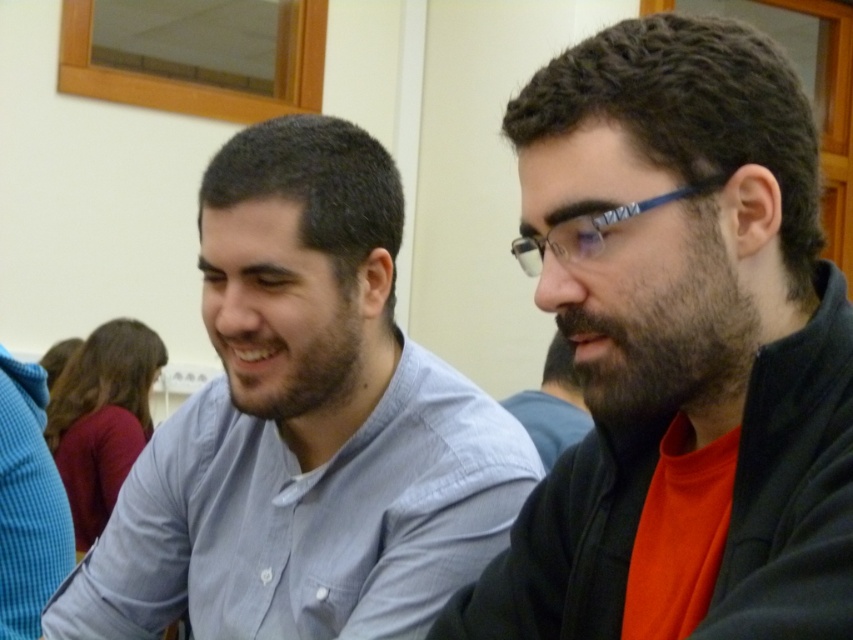
Does matte black jacket at right lie in front of light blue shirt at center?

Yes.

Between matte black jacket at right and light blue shirt at center, which one appears on the right side from the viewer's perspective?

matte black jacket at right is more to the right.

Which is in front, point (811, 220) or point (317, 608)?

Positioned in front is point (811, 220).

Where is `matte black jacket at right`? The image size is (853, 640). matte black jacket at right is located at coordinates (679, 349).

Is light blue shirt at center behind beard at center?

That is False.

The image size is (853, 640). Describe the element at coordinates (305, 426) in the screenshot. I see `light blue shirt at center` at that location.

Which is in front, point (335, 515) or point (532, 408)?

Point (335, 515) is in front.

You are a GUI agent. You are given a task and a screenshot of the screen. Output one action in this format:
    pyautogui.click(x=<x>, y=<y>)
    Task: Click on the light blue shirt at center
    
    Given the screenshot: What is the action you would take?
    pyautogui.click(x=305, y=426)

Does point (654, 124) come in front of point (544, 392)?

Yes, it is in front of point (544, 392).

Can you confirm if matte black jacket at right is shorter than beard at center?

Incorrect, matte black jacket at right's height does not fall short of beard at center's.

Describe the element at coordinates (679, 349) in the screenshot. The width and height of the screenshot is (853, 640). I see `matte black jacket at right` at that location.

Identify the location of matte black jacket at right. This screenshot has height=640, width=853. (679, 349).